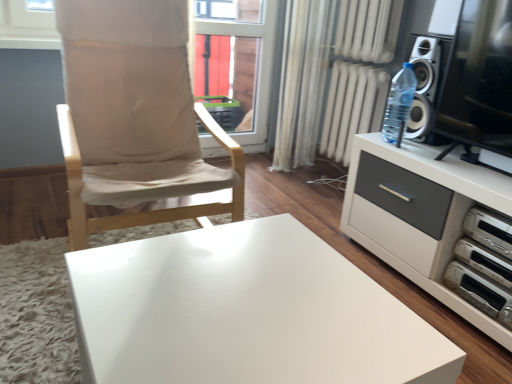
What do you see at coordinates (489, 230) in the screenshot? I see `white plastic dvd player at right, which is the 2th appliance in bottom-to-top order` at bounding box center [489, 230].

What do you see at coordinates (135, 116) in the screenshot?
I see `beige fabric chair at left` at bounding box center [135, 116].

In order to face transparent glass window at center, should I rotate leftwards or rightwards?

A 2.768 degree turn to the left will do.

You are a GUI agent. You are given a task and a screenshot of the screen. Output one action in this format:
    pyautogui.click(x=<x>, y=<y>)
    Task: Click on the white plastic dvd player at right, which is the 2th appliance in bottom-to-top order
    Image resolution: width=512 pixels, height=384 pixels.
    Given the screenshot: What is the action you would take?
    [489, 230]

From the image's perspective, is transparent glass window at center above or below white plastic stereo at lower right?

Based on their image positions, transparent glass window at center is located above white plastic stereo at lower right.

Measure the distance from transparent glass window at center to white plastic stereo at lower right.

transparent glass window at center is 1.96 meters away from white plastic stereo at lower right.

Is the position of transparent glass window at center less distant than that of white plastic stereo at lower right?

No, transparent glass window at center is behind white plastic stereo at lower right.

Can you confirm if transparent glass window at center is bigger than white plastic stereo at lower right?

Correct, transparent glass window at center is larger in size than white plastic stereo at lower right.

Considering the sizes of objects white plastic dvd player at lower right, placed as the 2th appliance when sorted from top to bottom, and beige fabric chair at left in the image provided, who is smaller, white plastic dvd player at lower right, placed as the 2th appliance when sorted from top to bottom, or beige fabric chair at left?

white plastic dvd player at lower right, placed as the 2th appliance when sorted from top to bottom, is smaller.

Which object is closer to the camera, white plastic dvd player at lower right, placed as the 2th appliance when sorted from top to bottom, or beige fabric chair at left?

beige fabric chair at left is in front.

Can you see white plastic dvd player at lower right, placed as the 2th appliance when sorted from top to bottom, touching beige fabric chair at left?

No, white plastic dvd player at lower right, placed as the 2th appliance when sorted from top to bottom, is not touching beige fabric chair at left.

From the image's perspective, is white plastic dvd player at lower right, which appears as the first appliance when ordered from the bottom, over beige fabric chair at left?

No, from the image's perspective, white plastic dvd player at lower right, which appears as the first appliance when ordered from the bottom, is not on top of beige fabric chair at left.

From a real-world perspective, who is located lower, white plastic stereo at lower right or white plastic dvd player at right, which is the 2th appliance in bottom-to-top order?

white plastic stereo at lower right.

Is white plastic stereo at lower right far from white plastic dvd player at right, which is the 2th appliance in bottom-to-top order?

white plastic stereo at lower right is near white plastic dvd player at right, which is the 2th appliance in bottom-to-top order, not far away.

Is the depth of white plastic stereo at lower right greater than that of white plastic dvd player at right, which is the 1th appliance from top to bottom?

Yes, white plastic stereo at lower right is further from the viewer.

Is white plastic stereo at lower right bigger or smaller than white plastic dvd player at right, which is the 1th appliance from top to bottom?

In the image, white plastic stereo at lower right appears to be smaller than white plastic dvd player at right, which is the 1th appliance from top to bottom.

From a real-world perspective, between white plastic dvd player at lower right, placed as the 2th appliance when sorted from top to bottom, and white glossy table at center, who is vertically lower?

white plastic dvd player at lower right, placed as the 2th appliance when sorted from top to bottom.

Who is shorter, white plastic dvd player at lower right, which appears as the first appliance when ordered from the bottom, or white glossy table at center?

With less height is white plastic dvd player at lower right, which appears as the first appliance when ordered from the bottom.

Considering the sizes of objects white plastic dvd player at lower right, which appears as the first appliance when ordered from the bottom, and white glossy table at center in the image provided, who is wider, white plastic dvd player at lower right, which appears as the first appliance when ordered from the bottom, or white glossy table at center?

white glossy table at center is wider.

Is white plastic dvd player at lower right, which appears as the first appliance when ordered from the bottom, turned away from white glossy table at center?

No, white plastic dvd player at lower right, which appears as the first appliance when ordered from the bottom, is not facing away from white glossy table at center.

Is transparent glass screen door at right positioned with its back to white sheer curtain at center?

No, white sheer curtain at center is not at the back of transparent glass screen door at right.

Relative to white sheer curtain at center, is transparent glass screen door at right in front or behind?

In the image, transparent glass screen door at right appears in front of white sheer curtain at center.

Is white glossy table at center turned away from transparent glass window at center?

No, transparent glass window at center is not at the back of white glossy table at center.

Based on the photo, from the image's perspective, between white glossy table at center and transparent glass window at center, who is located below?

white glossy table at center appears lower in the image.

Considering the positions of objects white glossy table at center and transparent glass window at center in the image provided, who is in front, white glossy table at center or transparent glass window at center?

white glossy table at center is more forward.

From a real-world perspective, which object rests below the other?

From a 3D spatial view, white plastic dvd player at right, which is the 1th appliance from top to bottom, is below.

Between point (314, 150) and point (478, 230), which one is positioned in front?

The point (478, 230) is closer to the camera.

From the image's perspective, is white sheer curtain at center located beneath white plastic dvd player at right, which is the 1th appliance from top to bottom?

No, from the image's perspective, white sheer curtain at center is not beneath white plastic dvd player at right, which is the 1th appliance from top to bottom.

In the scene shown: Is white sheer curtain at center positioned beyond the bounds of white plastic dvd player at right, which is the 2th appliance in bottom-to-top order?

white sheer curtain at center lies outside white plastic dvd player at right, which is the 2th appliance in bottom-to-top order,'s area.

Identify the location of window screen behind the white plastic stereo at lower right. (236, 64).

Where is `chair above the white plastic dvd player at lower right, which appears as the first appliance when ordered from the bottom (from the image's perspective)`? This screenshot has width=512, height=384. chair above the white plastic dvd player at lower right, which appears as the first appliance when ordered from the bottom (from the image's perspective) is located at coordinates (135, 116).

Which object lies nearer to the anchor point white sheer curtain at center, transparent glass screen door at right or beige fabric chair at left?

beige fabric chair at left is closer to white sheer curtain at center.

Considering their positions, is white plastic dvd player at right, which is the 2th appliance in bottom-to-top order, positioned further to white glossy table at center than beige fabric chair at left?

Among the two, white plastic dvd player at right, which is the 2th appliance in bottom-to-top order, is located further to white glossy table at center.

Which object lies nearer to the anchor point white plastic dvd player at lower right, placed as the 2th appliance when sorted from top to bottom, beige fabric chair at left or transparent glass screen door at right?

Based on the image, transparent glass screen door at right appears to be nearer to white plastic dvd player at lower right, placed as the 2th appliance when sorted from top to bottom.

Based on their spatial positions, is transparent glass screen door at right or white plastic stereo at lower right further from white plastic dvd player at lower right, placed as the 2th appliance when sorted from top to bottom?

Based on the image, transparent glass screen door at right appears to be further to white plastic dvd player at lower right, placed as the 2th appliance when sorted from top to bottom.

Based on their spatial positions, is transparent glass screen door at right or white glossy table at center further from transparent glass window at center?

white glossy table at center is further to transparent glass window at center.

When comparing their distances from transparent glass window at center, does white glossy table at center or white plastic dvd player at lower right, placed as the 2th appliance when sorted from top to bottom, seem closer?

white plastic dvd player at lower right, placed as the 2th appliance when sorted from top to bottom, lies closer to transparent glass window at center than the other object.

Looking at the image, which one is located further to white plastic stereo at lower right, transparent glass window at center or transparent glass screen door at right?

transparent glass window at center is positioned further to the anchor white plastic stereo at lower right.

From the image, which object appears to be farther from white plastic stereo at lower right, white plastic dvd player at lower right, placed as the 2th appliance when sorted from top to bottom, or white sheer curtain at center?

white sheer curtain at center.

The width and height of the screenshot is (512, 384). I want to click on screen door situated between white glossy table at center and white plastic stereo at lower right from left to right, so click(480, 83).

This screenshot has height=384, width=512. I want to click on curtain between beige fabric chair at left and transparent glass window at center along the z-axis, so click(x=302, y=81).

In order to click on stereo between white plastic dvd player at lower right, which appears as the first appliance when ordered from the bottom, and transparent glass window at center, along the z-axis in this screenshot , I will do `click(484, 264)`.

Where is `stereo between beige fabric chair at left and transparent glass window at center in the front-back direction`? Image resolution: width=512 pixels, height=384 pixels. stereo between beige fabric chair at left and transparent glass window at center in the front-back direction is located at coordinates (484, 264).